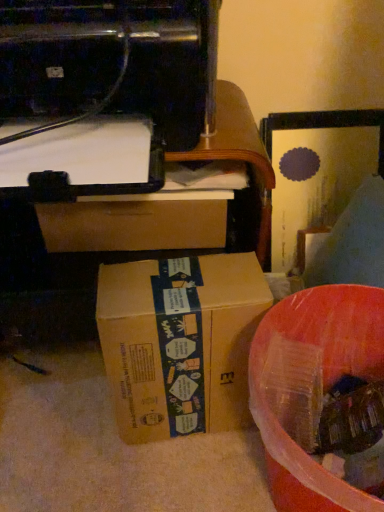
This screenshot has height=512, width=384. I want to click on translucent plastic container at lower right, so click(323, 380).

In order to click on brown cardboard box at center in this screenshot , I will do `click(180, 342)`.

From the image's perspective, is black plastic printer at upper left above translucent plastic container at lower right?

Yes.

Considering the relative positions of black plastic printer at upper left and translucent plastic container at lower right in the image provided, is black plastic printer at upper left to the left or to the right of translucent plastic container at lower right?

Based on their positions, black plastic printer at upper left is located to the left of translucent plastic container at lower right.

In the image, is black plastic printer at upper left positioned in front of or behind translucent plastic container at lower right?

black plastic printer at upper left is positioned closer to the viewer than translucent plastic container at lower right.

Considering the points (211, 65) and (302, 477), which point is in front, point (211, 65) or point (302, 477)?

The point (302, 477) is closer.

Where is `printer in front of the brown cardboard box at center`? printer in front of the brown cardboard box at center is located at coordinates (102, 92).

Do you think black plastic printer at upper left is within brown cardboard box at center, or outside of it?

The correct answer is: outside.

Is point (35, 84) positioned after point (215, 301)?

Yes.

Is black plastic printer at upper left smaller than brown cardboard box at center?

Incorrect, black plastic printer at upper left is not smaller in size than brown cardboard box at center.

Could you tell me if brown cardboard box at center is turned towards translucent plastic container at lower right?

No, brown cardboard box at center is not aimed at translucent plastic container at lower right.

At what (x,y) coordinates should I click in order to perform the action: click on box on the left side of translucent plastic container at lower right. Please return your answer as a coordinate pair (x, y). The height and width of the screenshot is (512, 384). Looking at the image, I should click on (180, 342).

From the image's perspective, between brown cardboard box at center and translucent plastic container at lower right, who is located below?

translucent plastic container at lower right is shown below in the image.

How many degrees apart are the facing directions of brown cardboard box at center and translucent plastic container at lower right?

The angular difference between brown cardboard box at center and translucent plastic container at lower right is 98 degrees.

From a real-world perspective, is translucent plastic container at lower right physically located above or below black plastic printer at upper left?

From a real-world perspective, translucent plastic container at lower right is physically below black plastic printer at upper left.

Could you tell me if translucent plastic container at lower right is facing black plastic printer at upper left?

No, translucent plastic container at lower right is not aimed at black plastic printer at upper left.

Could you measure the distance between translucent plastic container at lower right and black plastic printer at upper left?

The distance of translucent plastic container at lower right from black plastic printer at upper left is 13.86 inches.

Considering the sizes of objects translucent plastic container at lower right and black plastic printer at upper left in the image provided, who is taller, translucent plastic container at lower right or black plastic printer at upper left?

translucent plastic container at lower right.

Is brown cardboard box at center at the left side of black plastic printer at upper left?

Incorrect, brown cardboard box at center is not on the left side of black plastic printer at upper left.

Is brown cardboard box at center far from black plastic printer at upper left?

brown cardboard box at center is near black plastic printer at upper left, not far away.

Image resolution: width=384 pixels, height=512 pixels. Find the location of `box behind the black plastic printer at upper left`. box behind the black plastic printer at upper left is located at coordinates (180, 342).

Could you tell me if brown cardboard box at center is facing black plastic printer at upper left?

No, brown cardboard box at center is not facing towards black plastic printer at upper left.

Which object is wider, translucent plastic container at lower right or brown cardboard box at center?

translucent plastic container at lower right.

Can you confirm if translucent plastic container at lower right is positioned to the left of brown cardboard box at center?

In fact, translucent plastic container at lower right is to the right of brown cardboard box at center.

Can you confirm if translucent plastic container at lower right is taller than brown cardboard box at center?

Indeed, translucent plastic container at lower right has a greater height compared to brown cardboard box at center.

Is translucent plastic container at lower right positioned in front of brown cardboard box at center?

Yes, it is in front of brown cardboard box at center.

Find the location of a particular element. waste below the black plastic printer at upper left (from the image's perspective) is located at coordinates (323, 380).

Locate an element on the screen. printer in front of the brown cardboard box at center is located at coordinates (102, 92).

Looking at the image, which one is located closer to brown cardboard box at center, black plastic printer at upper left or translucent plastic container at lower right?

translucent plastic container at lower right.

From the image, which object appears to be farther from black plastic printer at upper left, translucent plastic container at lower right or brown cardboard box at center?

translucent plastic container at lower right.

From the image, which object appears to be farther from translucent plastic container at lower right, brown cardboard box at center or black plastic printer at upper left?

black plastic printer at upper left lies further to translucent plastic container at lower right than the other object.

Considering their positions, is translucent plastic container at lower right positioned closer to brown cardboard box at center than black plastic printer at upper left?

translucent plastic container at lower right lies closer to brown cardboard box at center than the other object.

Based on their spatial positions, is brown cardboard box at center or translucent plastic container at lower right further from black plastic printer at upper left?

translucent plastic container at lower right.

Based on the photo, which object lies nearer to the anchor point translucent plastic container at lower right, black plastic printer at upper left or brown cardboard box at center?

The object closer to translucent plastic container at lower right is brown cardboard box at center.

Locate an element on the screen. The width and height of the screenshot is (384, 512). box between black plastic printer at upper left and translucent plastic container at lower right from top to bottom is located at coordinates (180, 342).